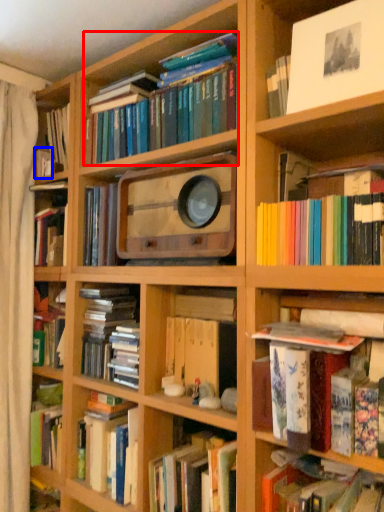
Question: Which object appears closest to the camera in this image, book (highlighted by a red box) or book (highlighted by a blue box)?

Choices:
 (A) book
 (B) book

Answer: (A)